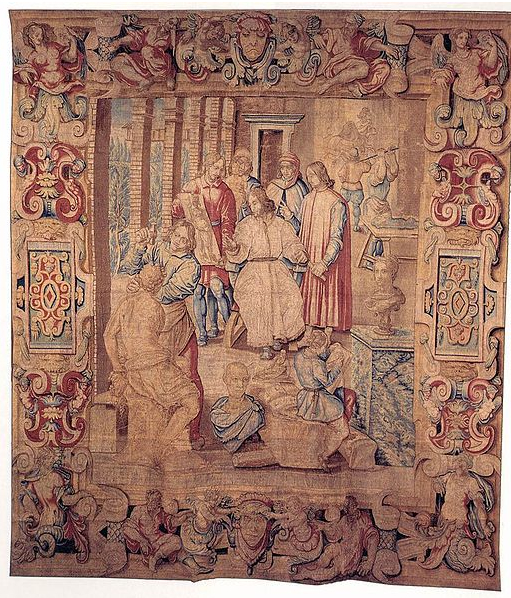
The image size is (511, 598). Identify the location of seated individual. (304, 364), (268, 244).